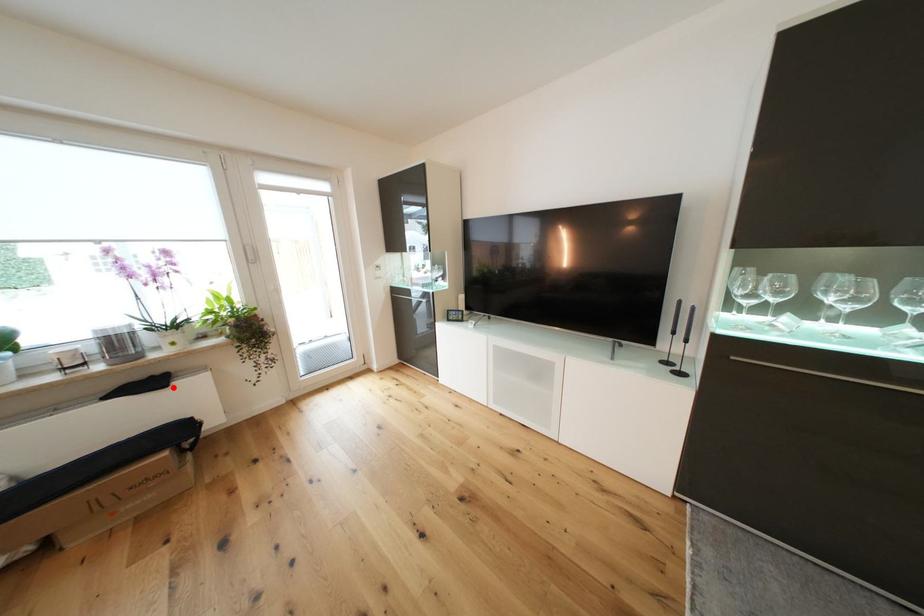
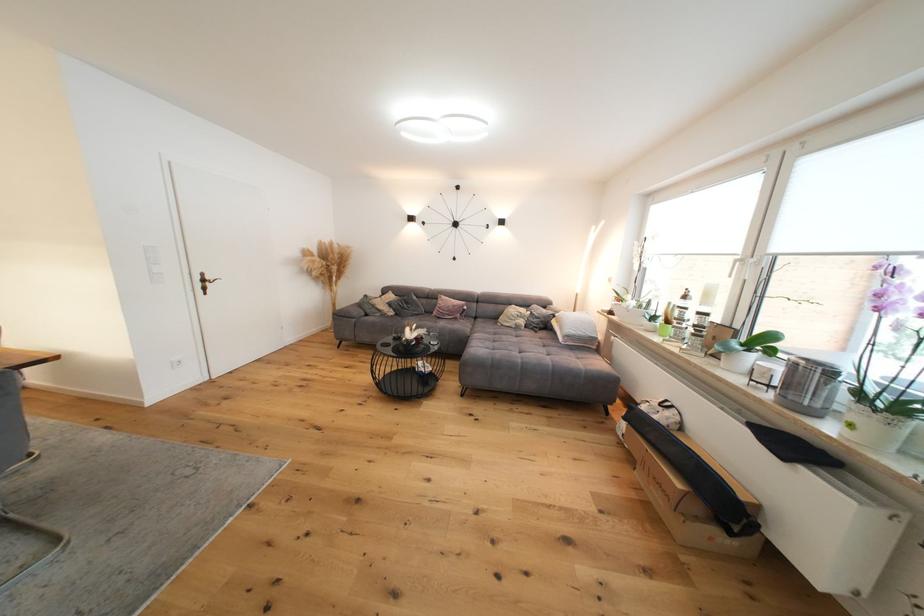
Find the pixel in the second image that matches the highlighted location in the first image.

(793, 461)